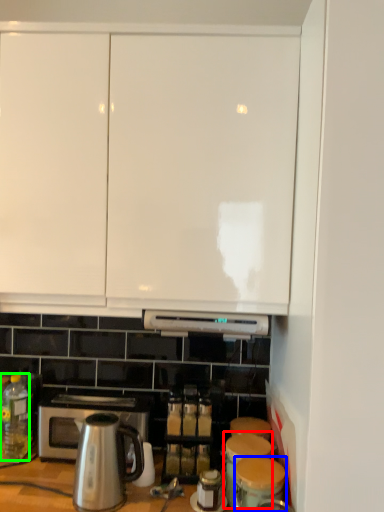
Question: Which object is positioned farthest from appliance (highlighted by a red box)? Select from appliance (highlighted by a blue box) and bottle (highlighted by a green box).

Choices:
 (A) appliance
 (B) bottle

Answer: (B)